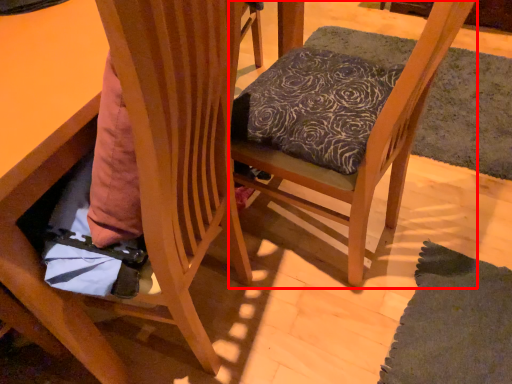
Question: Observing the image, what is the correct spatial positioning of chair (annotated by the red box) in reference to chair?

Choices:
 (A) left
 (B) right

Answer: (B)